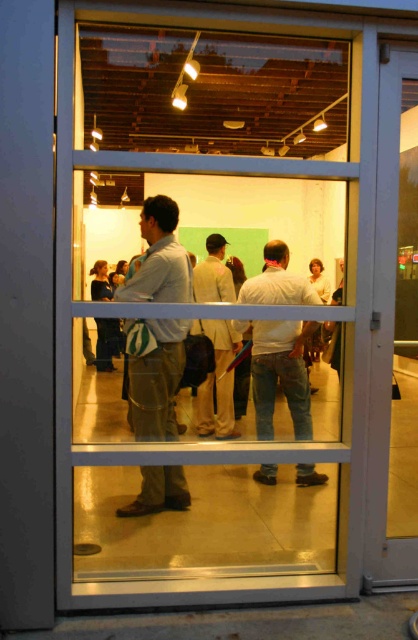
Can you confirm if light brown fabric shirt at center is smaller than white cotton shirt at center?

Correct, light brown fabric shirt at center occupies less space than white cotton shirt at center.

What do you see at coordinates (158, 381) in the screenshot? I see `light brown fabric shirt at center` at bounding box center [158, 381].

Find the location of a particular element. light brown fabric shirt at center is located at coordinates (158, 381).

Find the location of a particular element. The height and width of the screenshot is (640, 418). clear glass door at center is located at coordinates (201, 312).

Is point (259, 342) positioned before point (262, 360)?

No.

At what (x,y) coordinates should I click in order to perform the action: click on clear glass door at center. Please return your answer as a coordinate pair (x, y). This screenshot has width=418, height=640. Looking at the image, I should click on (201, 312).

Is white glossy door at right closer to the viewer compared to white cotton shirt at center?

Yes, white glossy door at right is in front of white cotton shirt at center.

Is point (408, 198) more distant than point (297, 333)?

No, it is not.

Measure the distance between white glossy door at right and camera.

white glossy door at right is 9.10 feet away from camera.

Where is `white glossy door at right`? The width and height of the screenshot is (418, 640). white glossy door at right is located at coordinates (394, 332).